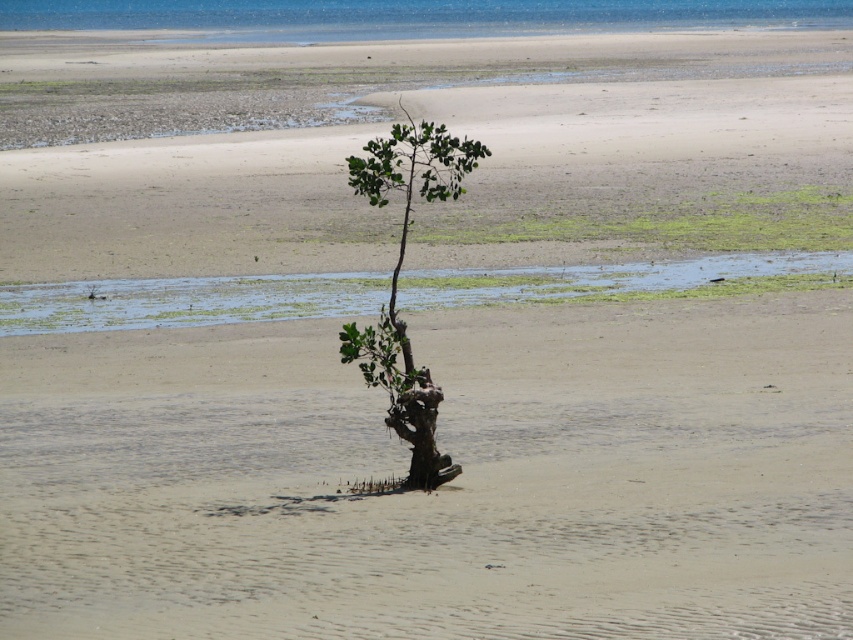
Question: Can you confirm if green leafy tree at center is smaller than brown rough tree trunk at center?

Choices:
 (A) no
 (B) yes

Answer: (A)

Question: Is green leafy tree at center to the right of brown rough tree trunk at center from the viewer's perspective?

Choices:
 (A) yes
 (B) no

Answer: (B)

Question: Does blue water at upper center have a larger size compared to green leafy tree at center?

Choices:
 (A) yes
 (B) no

Answer: (A)

Question: Which of the following is the farthest from the observer?

Choices:
 (A) pyautogui.click(x=804, y=3)
 (B) pyautogui.click(x=408, y=404)
 (C) pyautogui.click(x=424, y=422)

Answer: (A)

Question: Which point is farther to the camera?

Choices:
 (A) (425, 410)
 (B) (430, 378)
 (C) (341, 35)

Answer: (C)

Question: Which of the following is the farthest from the observer?

Choices:
 (A) (404, 417)
 (B) (361, 20)
 (C) (436, 173)

Answer: (B)